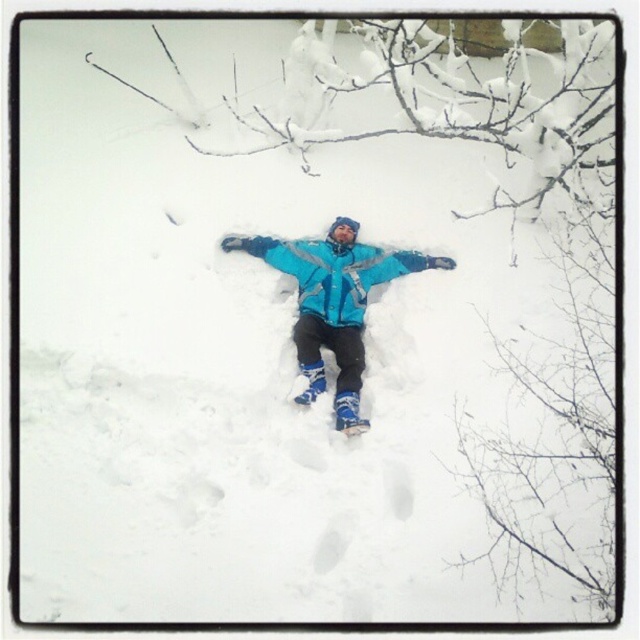
Question: Can you confirm if blue matte jacket at center is positioned below blue fleece jacket at center?

Choices:
 (A) yes
 (B) no

Answer: (A)

Question: Can you confirm if blue matte jacket at center is smaller than blue fleece jacket at center?

Choices:
 (A) no
 (B) yes

Answer: (A)

Question: Which of the following is the farthest from the observer?

Choices:
 (A) blue matte jacket at center
 (B) blue fleece jacket at center

Answer: (B)

Question: Is blue matte jacket at center bigger than blue fleece jacket at center?

Choices:
 (A) no
 (B) yes

Answer: (B)

Question: Which of the following is the farthest from the observer?

Choices:
 (A) (336, 298)
 (B) (340, 301)

Answer: (A)